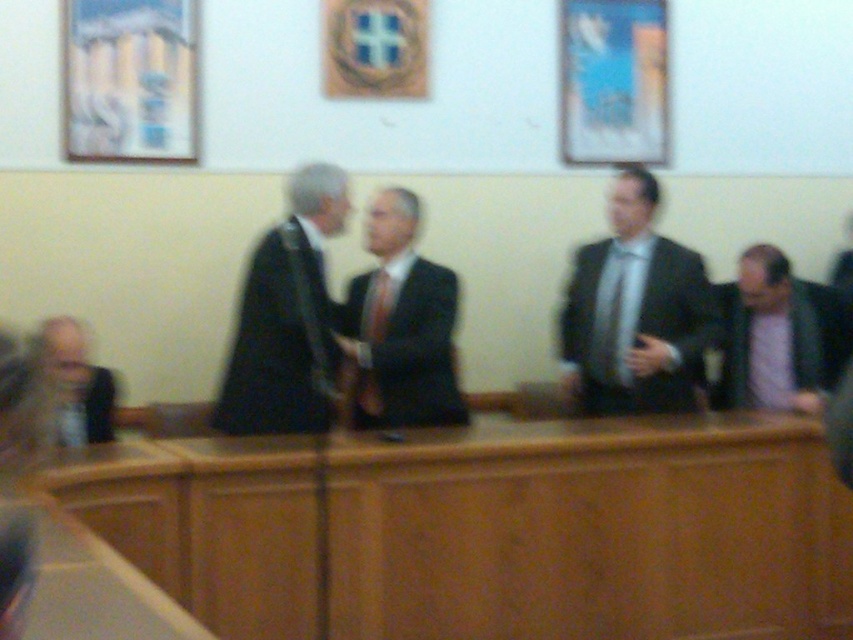
You are an observer in the courtroom scene. You notice two individuals dressed in black matte suit at center and light brown leather jacket at lower left. Which one is located to the right of the other?

The black matte suit at center is positioned on the right side of light brown leather jacket at lower left.

Based on the scene description, where is the matte black suit at right located in the image?

The matte black suit at right is located at point (635, 310) in the image.